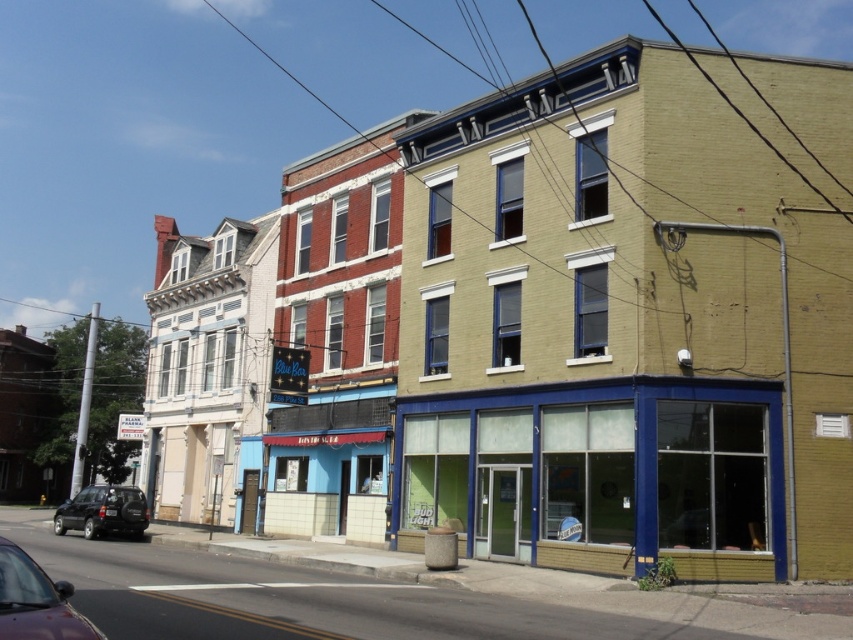
The height and width of the screenshot is (640, 853). What do you see at coordinates (625, 326) in the screenshot? I see `yellow brick building at center` at bounding box center [625, 326].

The height and width of the screenshot is (640, 853). Describe the element at coordinates (625, 326) in the screenshot. I see `yellow brick building at center` at that location.

The width and height of the screenshot is (853, 640). I want to click on yellow brick building at center, so (625, 326).

From the picture: Can you confirm if matte blue storefront at lower right is shorter than shiny maroon sedan at lower left?

In fact, matte blue storefront at lower right may be taller than shiny maroon sedan at lower left.

Does matte blue storefront at lower right come behind shiny maroon sedan at lower left?

Yes, matte blue storefront at lower right is behind shiny maroon sedan at lower left.

Locate an element on the screen. This screenshot has width=853, height=640. matte blue storefront at lower right is located at coordinates (605, 474).

Which of these two, yellow brick building at center or shiny black suv at lower left, stands taller?

yellow brick building at center is taller.

Can you confirm if yellow brick building at center is positioned above shiny black suv at lower left?

Yes, yellow brick building at center is above shiny black suv at lower left.

Identify the location of yellow brick building at center. This screenshot has height=640, width=853. (625, 326).